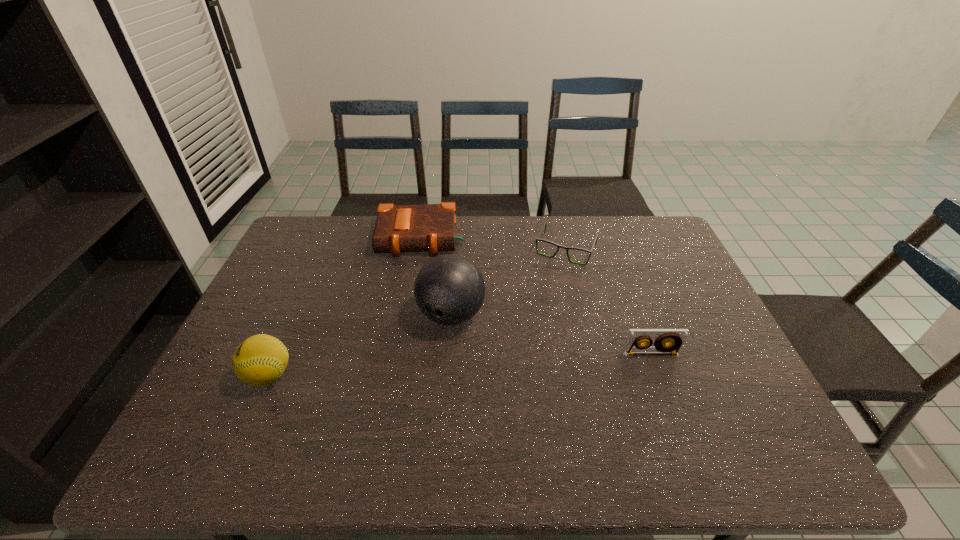
Identify the location of vacant space located on the spine side of the Bible. (418, 275).

Image resolution: width=960 pixels, height=540 pixels. What are the coordinates of `vacant region located on the spine side of the Bible` in the screenshot? It's located at (412, 343).

The height and width of the screenshot is (540, 960). Identify the location of free space located 0.070m on the lens of the shortest object. (551, 279).

Identify the location of vacant space located 0.200m on the lens of the shortest object. (539, 306).

Locate an element on the screen. This screenshot has height=540, width=960. vacant space located on the lens of the shortest object is located at coordinates (543, 295).

You are a GUI agent. You are given a task and a screenshot of the screen. Output one action in this format:
    pyautogui.click(x=<x>, y=<y>)
    Task: Click on the vacant area located 0.090m on the grip area of the bowling ball
    The image size is (960, 540).
    Given the screenshot: What is the action you would take?
    pyautogui.click(x=419, y=362)

You are a GUI agent. You are given a task and a screenshot of the screen. Output one action in this format:
    pyautogui.click(x=<x>, y=<y>)
    Task: Click on the free region located on the grip area of the bowling ball
    
    Given the screenshot: What is the action you would take?
    pyautogui.click(x=419, y=362)

Locate an element on the screen. free space located on the grip area of the bowling ball is located at coordinates click(x=406, y=380).

Locate an element on the screen. Bible situated at the far edge is located at coordinates (430, 228).

Locate an element on the screen. The width and height of the screenshot is (960, 540). spectacles at the far edge is located at coordinates (545, 225).